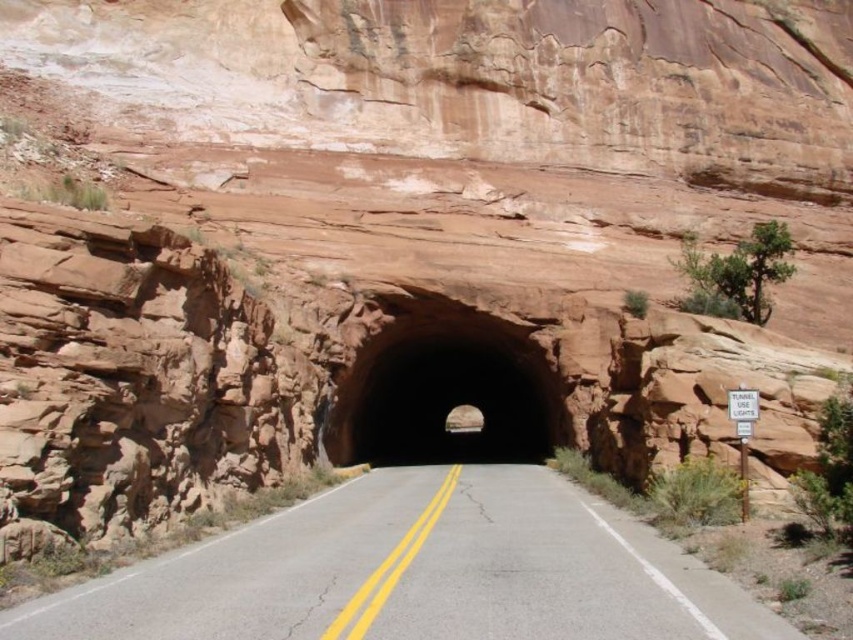
Question: Which point is farther to the camera?

Choices:
 (A) (25, 612)
 (B) (380, 410)

Answer: (B)

Question: Is asphalt road at center thinner than brown rock tunnel at center?

Choices:
 (A) yes
 (B) no

Answer: (A)

Question: Does asphalt road at center appear under brown rock tunnel at center?

Choices:
 (A) no
 (B) yes

Answer: (A)

Question: Which of the following is the farthest from the observer?

Choices:
 (A) (436, 438)
 (B) (376, 486)

Answer: (A)

Question: Which of the following is the closest to the observer?

Choices:
 (A) brown rock tunnel at center
 (B) asphalt road at center

Answer: (B)

Question: Is asphalt road at center to the right of brown rock tunnel at center from the viewer's perspective?

Choices:
 (A) no
 (B) yes

Answer: (A)